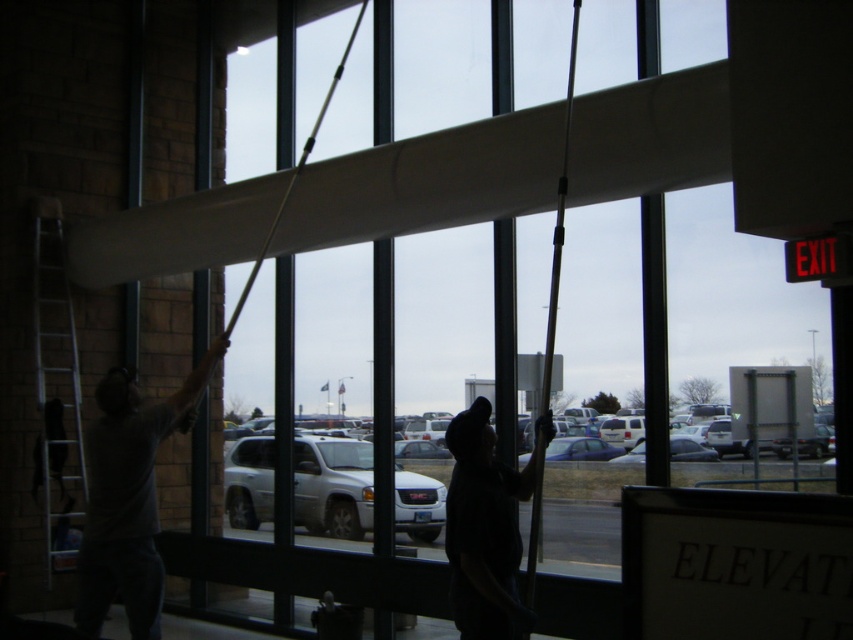
Does white smooth beam at center appear on the right side of dark gray fabric at center?

In fact, white smooth beam at center is to the left of dark gray fabric at center.

Who is positioned more to the left, white smooth beam at center or dark gray fabric at center?

From the viewer's perspective, white smooth beam at center appears more on the left side.

I want to click on white smooth beam at center, so click(428, 182).

Consider the image. Does dark gray shirt at left appear under silver metallic ladder at left?

Correct, dark gray shirt at left is located below silver metallic ladder at left.

How much distance is there between dark gray shirt at left and silver metallic ladder at left?

They are 2.57 meters apart.

Does point (119, 541) lie in front of point (38, 284)?

Yes, point (119, 541) is closer to viewer.

In order to click on dark gray shirt at left in this screenshot , I will do `click(129, 497)`.

Consider the image. Who is higher up, white smooth beam at center or silver metallic ladder at left?

Positioned higher is white smooth beam at center.

Is point (283, 212) behind point (68, 544)?

No.

Where is `white smooth beam at center`? Image resolution: width=853 pixels, height=640 pixels. white smooth beam at center is located at coordinates (428, 182).